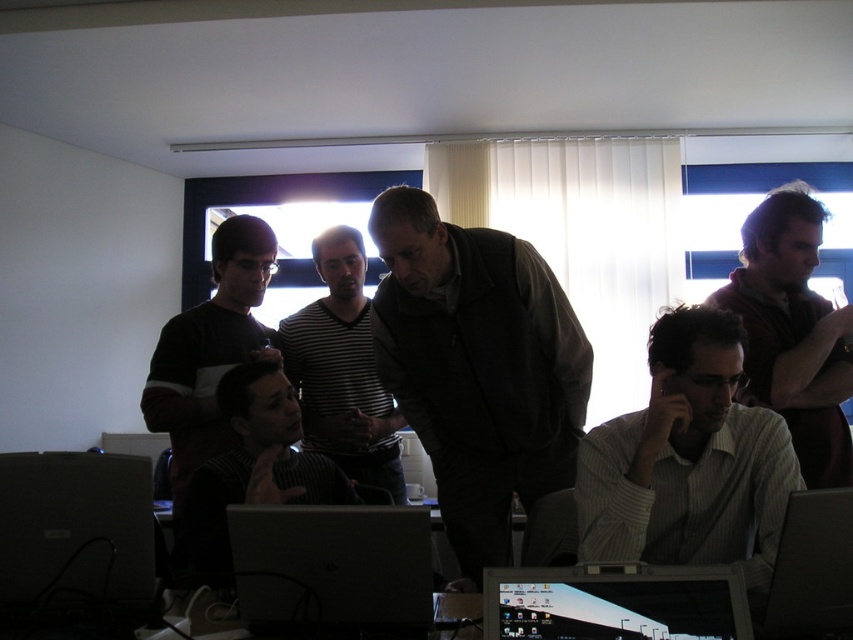
You are organizing a presentation and need to place a 12 inch wide projector next to the silver metallic laptop at center and striped shirt at center on the table. Based on the laptop and shirt width, will the projector fit between them without overlapping?

The silver metallic laptop at center is narrower than the striped shirt at center. However, the projector requires 12 inches of space. Since the exact width of the laptop and shirt isn not provided, we cannot determine if there is enough space between them for the projector.

You are a person sitting at the table and want to reach both the matte silver laptop at lower left and the metallic silver laptop at lower right. Which laptop will you need to stretch your arm further to reach?

You will need to stretch further to reach the metallic silver laptop at lower right because it is farther away from you than the matte silver laptop at lower left.

You are a new employee entering the office and need to locate the matte silver laptop at lower left and the matte black monitor at lower center. Based on their positions, which object would be closer to the left side of the table?

The matte silver laptop at lower left is closer to the left side of the table since it is positioned to the left of the matte black monitor at lower center.